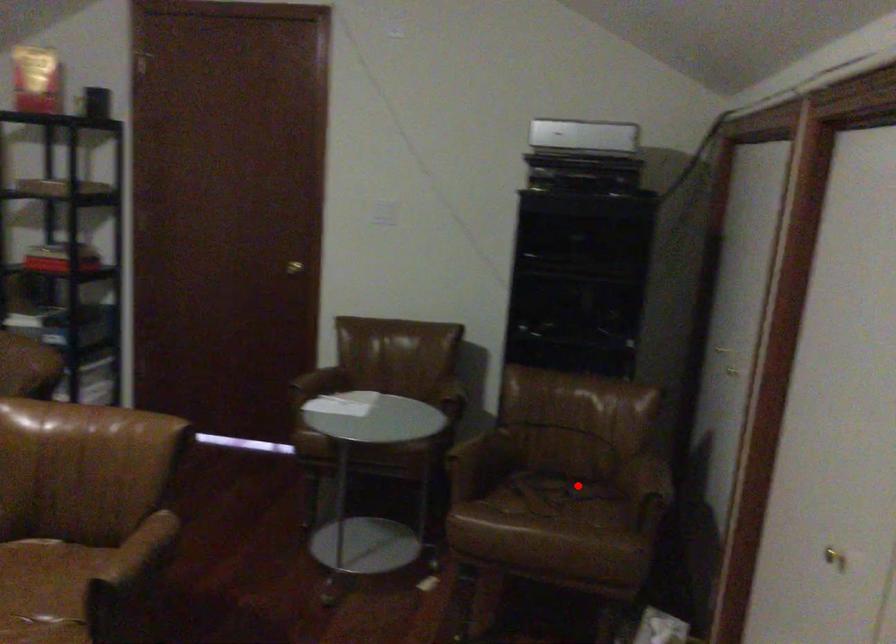
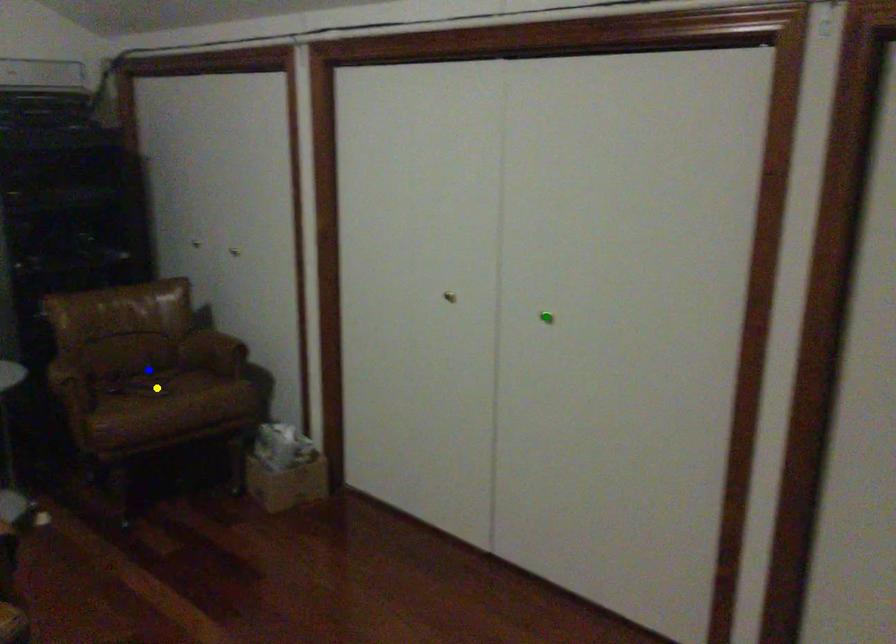
Question: I am providing you with two images of the same scene from different viewpoints. A red point is marked on the first image. You are given multiple points on the second image. Which spot in image 2 lines up with the point in image 1?

Choices:
 (A) green point
 (B) blue point
 (C) yellow point

Answer: (B)